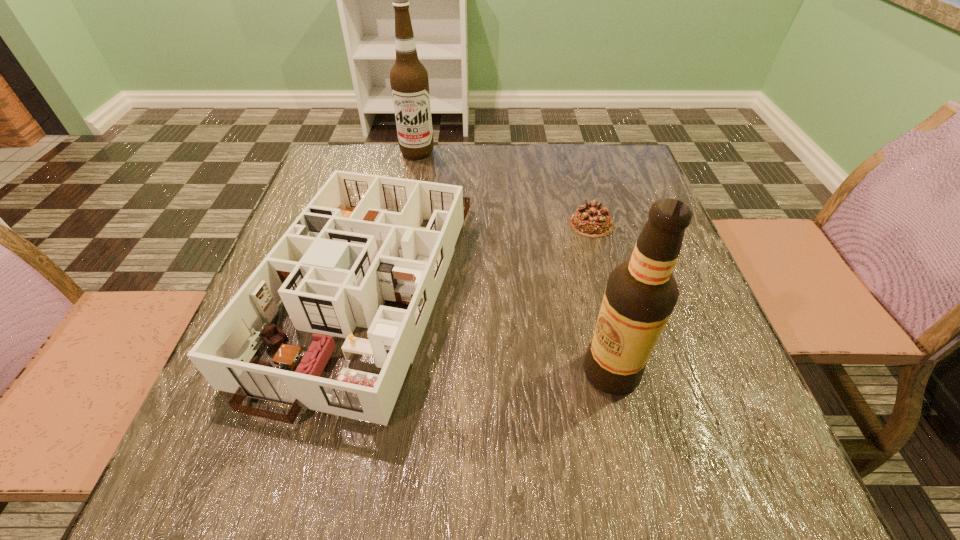
Locate an element on the screen. Image resolution: width=960 pixels, height=540 pixels. unoccupied position between the dollhouse and the nearer alcohol is located at coordinates (490, 328).

Identify the location of free space that is in between the nearer alcohol and the chocolate cake. The image size is (960, 540). (602, 298).

The height and width of the screenshot is (540, 960). What are the coordinates of `empty space that is in between the second shortest object and the chocolate cake` in the screenshot? It's located at coord(480,254).

The height and width of the screenshot is (540, 960). What are the coordinates of `blank region between the chocolate cake and the second shortest object` in the screenshot? It's located at (480, 254).

At what (x,y) coordinates should I click in order to perform the action: click on free area in between the shortest object and the nearer alcohol. Please return your answer as a coordinate pair (x, y). This screenshot has width=960, height=540. Looking at the image, I should click on (602, 298).

Locate an element on the screen. vacant space that's between the nearer alcohol and the farthest object is located at coordinates (515, 262).

At what (x,y) coordinates should I click in order to perform the action: click on vacant area that lies between the dollhouse and the nearer alcohol. Please return your answer as a coordinate pair (x, y). The image size is (960, 540). Looking at the image, I should click on (490, 328).

The width and height of the screenshot is (960, 540). I want to click on free space between the dollhouse and the chocolate cake, so point(480,254).

This screenshot has width=960, height=540. What are the coordinates of `the closest object relative to the farthest object` in the screenshot? It's located at click(x=359, y=242).

Select which object is the third closest to the right alcohol. Please provide its 2D coordinates. Your answer should be formatted as a tuple, i.e. [(x, y)], where the tuple contains the x and y coordinates of a point satisfying the conditions above.

[(409, 81)]